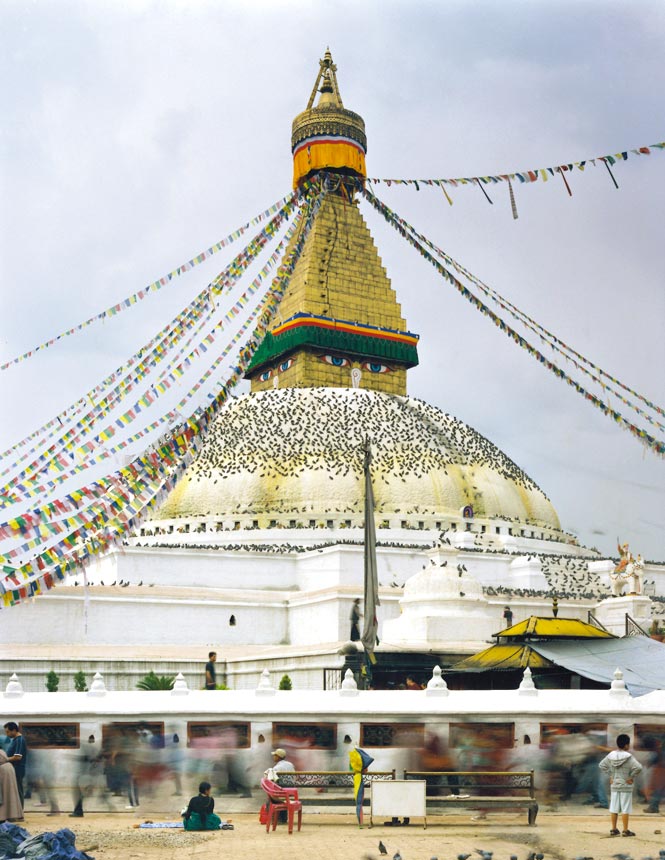
Locate an element on the screen. chair is located at coordinates (295, 807).